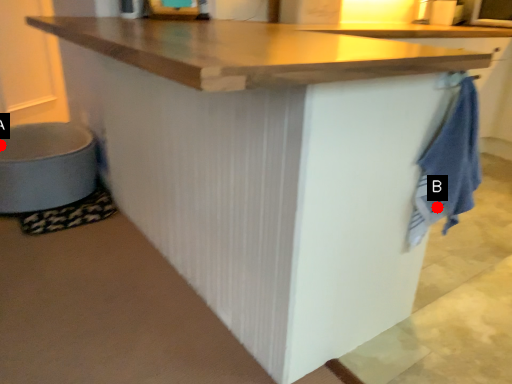
Question: Two points are circled on the image, labeled by A and B beside each circle. Which of the following is the farthest from the observer?

Choices:
 (A) A is further
 (B) B is further

Answer: (A)